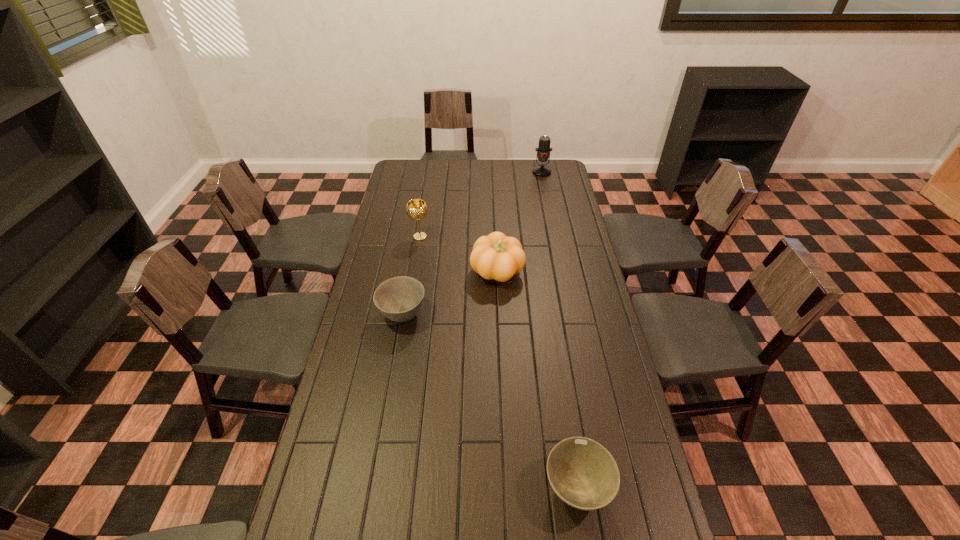
Where is `microphone`? The width and height of the screenshot is (960, 540). microphone is located at coordinates (543, 151).

Image resolution: width=960 pixels, height=540 pixels. I want to click on chalice, so click(x=416, y=209).

The image size is (960, 540). I want to click on pumpkin, so click(496, 256).

Where is `the left bowl`? The width and height of the screenshot is (960, 540). the left bowl is located at coordinates (399, 299).

Where is `the fourth farthest object`? the fourth farthest object is located at coordinates (399, 299).

You are a GUI agent. You are given a task and a screenshot of the screen. Output one action in this format:
    pyautogui.click(x=<x>, y=<y>)
    Task: Click on the nearest object
    
    Given the screenshot: What is the action you would take?
    (x=583, y=474)

The image size is (960, 540). I want to click on the nearer bowl, so click(x=583, y=474).

At what (x,y) coordinates should I click in order to perform the action: click on vacant space located on the side of the farthest object with the red ring. Please return your answer as a coordinate pair (x, y). The width and height of the screenshot is (960, 540). Looking at the image, I should click on (549, 211).

Locate an element on the screen. vacant point located 0.160m on the back of the fourth nearest object is located at coordinates (424, 210).

Where is `free point located 0.060m on the back of the pumpkin`? The image size is (960, 540). free point located 0.060m on the back of the pumpkin is located at coordinates click(x=496, y=246).